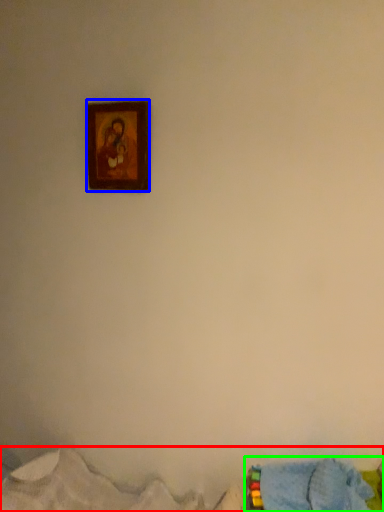
Question: Considering the real-world distances, which object is farthest from bed (highlighted by a red box)? picture frame (highlighted by a blue box) or bed (highlighted by a green box)?

Choices:
 (A) picture frame
 (B) bed

Answer: (A)